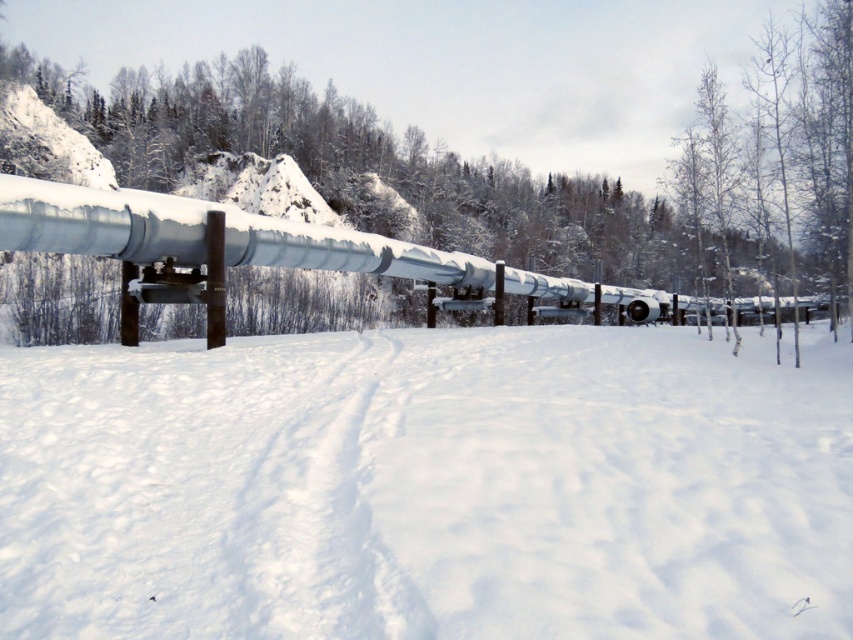
Can you confirm if smooth bark tree at center is taller than sleek metallic pipeline at center?

Yes, smooth bark tree at center is taller than sleek metallic pipeline at center.

Which is in front, point (827, 157) or point (138, 227)?

Point (138, 227) is in front.

This screenshot has width=853, height=640. In order to click on smooth bark tree at center in this screenshot , I will do `click(525, 168)`.

Does white fluffy snow at center have a larger size compared to sleek metallic pipeline at center?

No, white fluffy snow at center is not bigger than sleek metallic pipeline at center.

Consider the image. Which is more to the left, white fluffy snow at center or sleek metallic pipeline at center?

white fluffy snow at center

Between point (236, 406) and point (187, 198), which one is positioned behind?

Positioned behind is point (187, 198).

At what (x,y) coordinates should I click in order to perform the action: click on white fluffy snow at center. Please return your answer as a coordinate pair (x, y). This screenshot has height=640, width=853. Looking at the image, I should click on (426, 486).

Locate an element on the screen. This screenshot has height=640, width=853. white fluffy snow at center is located at coordinates (426, 486).

Does white fluffy snow at center have a smaller size compared to smooth bark tree at center?

Yes, white fluffy snow at center is smaller than smooth bark tree at center.

Where is `white fluffy snow at center`? The image size is (853, 640). white fluffy snow at center is located at coordinates (426, 486).